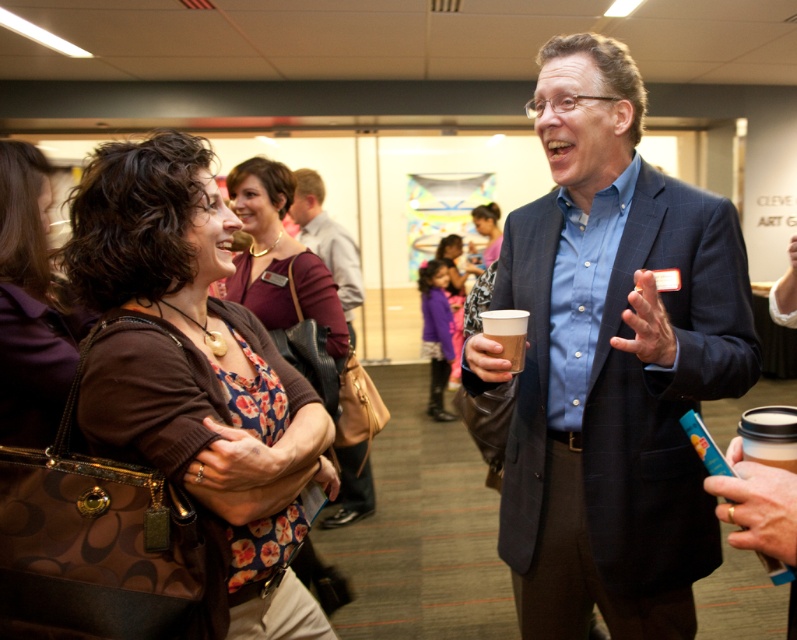
Question: Among these objects, which one is nearest to the camera?

Choices:
 (A) brown paper cup at center
 (B) white paper cup at upper right
 (C) blue textured blazer at center
 (D) floral fabric dress at center

Answer: (B)

Question: Which object is the farthest from the brown leather purse at upper left?

Choices:
 (A) purple fuzzy coat at center
 (B) white paper cup at upper right
 (C) floral fabric dress at center
 (D) brown paper cup at center

Answer: (A)

Question: Can you confirm if purple fuzzy coat at center is wider than brown paper cup at center?

Choices:
 (A) no
 (B) yes

Answer: (B)

Question: Among these points, which one is farthest from the camera?

Choices:
 (A) (271, 172)
 (B) (434, 381)
 (C) (642, 387)
 (D) (65, 246)

Answer: (B)

Question: Can you confirm if brown leather purse at upper left is positioned above purple fuzzy coat at center?

Choices:
 (A) yes
 (B) no

Answer: (B)

Question: Is brown leather jacket at center positioned in front of brown paper cup at center?

Choices:
 (A) no
 (B) yes

Answer: (A)